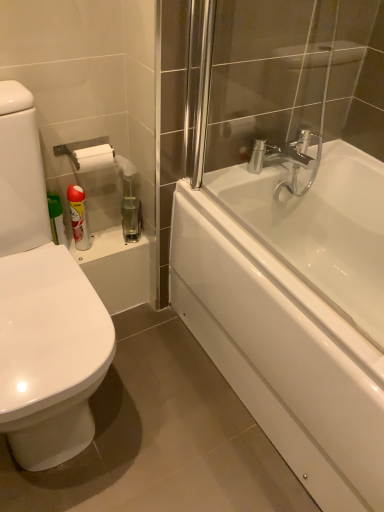
I want to click on free area in between white glossy can at upper left and translucent plastic spray bottle at upper left, so click(111, 239).